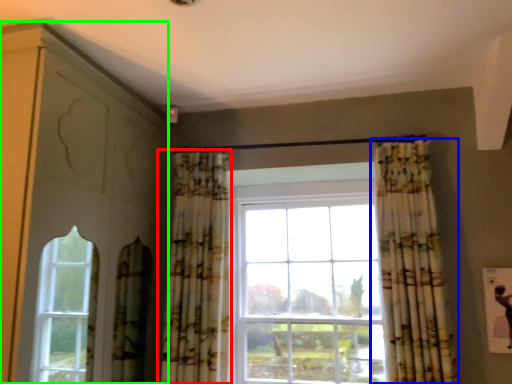
Question: Which is farther away from curtain (highlighted by a red box)? curtain (highlighted by a blue box) or dresser (highlighted by a green box)?

Choices:
 (A) curtain
 (B) dresser

Answer: (A)